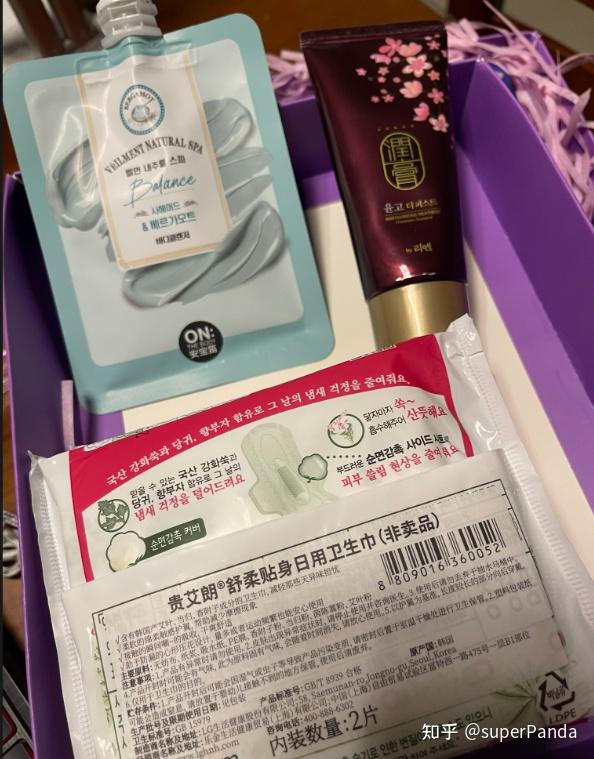
Image resolution: width=594 pixels, height=759 pixels. Find the location of `tray`. tray is located at coordinates (350, 319), (544, 254), (40, 354).